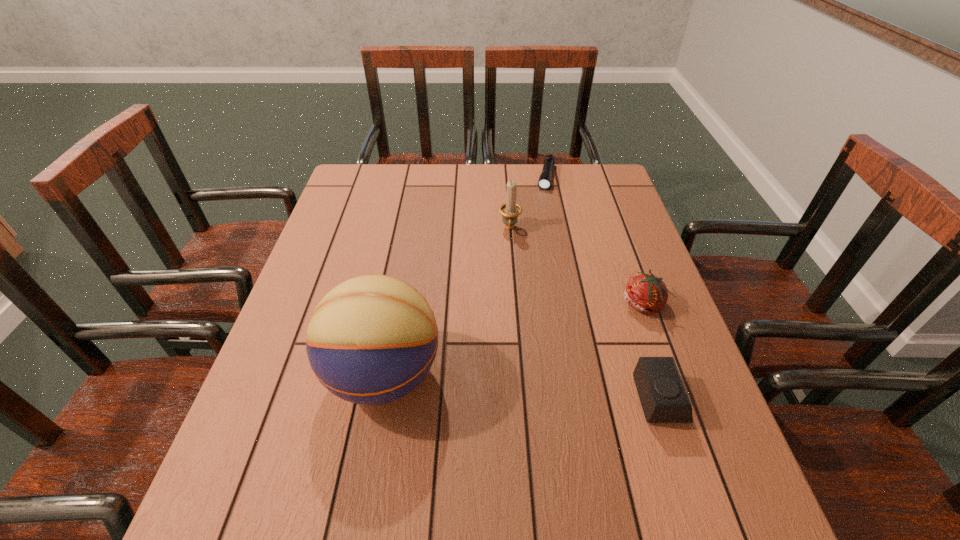
Where is `vacant space that is in between the tallest object and the alarm clock`? Image resolution: width=960 pixels, height=540 pixels. vacant space that is in between the tallest object and the alarm clock is located at coordinates (522, 387).

Select which object is the second closest to the candle_holder. Please provide its 2D coordinates. Your answer should be formatted as a tuple, i.e. [(x, y)], where the tuple contains the x and y coordinates of a point satisfying the conditions above.

[(646, 293)]

Identify which object is the third closest to the tallest object. Please provide its 2D coordinates. Your answer should be formatted as a tuple, i.e. [(x, y)], where the tuple contains the x and y coordinates of a point satisfying the conditions above.

[(646, 293)]

Where is `free region that satisfies the following two spatial constraints: 1. on the back side of the fourth object from right to left; 2. on the right side of the shortest object`? This screenshot has height=540, width=960. free region that satisfies the following two spatial constraints: 1. on the back side of the fourth object from right to left; 2. on the right side of the shortest object is located at coordinates (506, 177).

Find the location of a particular element. Image resolution: width=960 pixels, height=540 pixels. vacant space that satisfies the following two spatial constraints: 1. on the front side of the fourth shortest object; 2. on the front-facing side of the alarm clock is located at coordinates (523, 399).